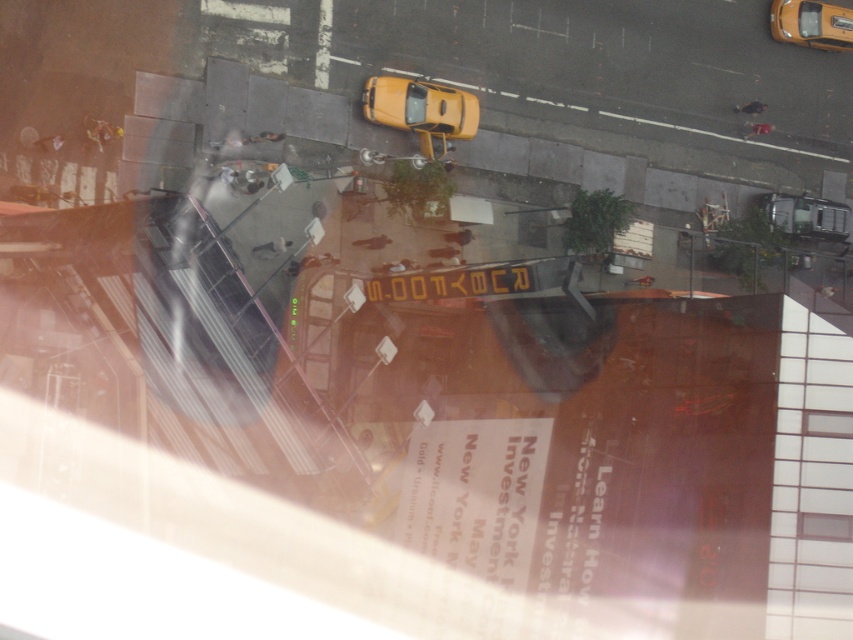
Who is shorter, yellow matte taxi at center or metallic silver car at lower right?

metallic silver car at lower right

Is yellow matte taxi at center thinner than metallic silver car at lower right?

In fact, yellow matte taxi at center might be wider than metallic silver car at lower right.

Which is in front, point (418, 99) or point (799, 221)?

Point (418, 99) is more forward.

At what (x,y) coordinates should I click in order to perform the action: click on yellow matte taxi at center. Please return your answer as a coordinate pair (x, y). Looking at the image, I should click on (421, 109).

Which is above, yellow matte taxi at center or yellow matte taxi at upper right?

yellow matte taxi at upper right is above.

Is yellow matte taxi at center positioned behind yellow matte taxi at upper right?

No, yellow matte taxi at center is in front of yellow matte taxi at upper right.

Is point (370, 113) closer to viewer compared to point (811, 45)?

Yes, point (370, 113) is closer to viewer.

At what (x,y) coordinates should I click in order to perform the action: click on yellow matte taxi at center. Please return your answer as a coordinate pair (x, y). The width and height of the screenshot is (853, 640). Looking at the image, I should click on (421, 109).

Is point (839, 35) positioned in front of point (773, 211)?

No, (839, 35) is further to viewer.

Is yellow matte taxi at upper right smaller than metallic silver car at lower right?

Correct, yellow matte taxi at upper right occupies less space than metallic silver car at lower right.

Is point (782, 28) positioned in front of point (804, 228)?

Yes.

This screenshot has height=640, width=853. Identify the location of yellow matte taxi at upper right. (811, 22).